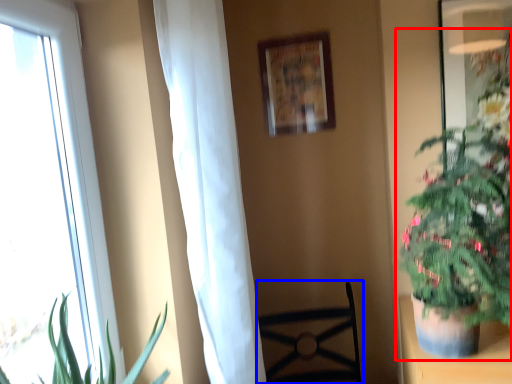
Question: Which object appears farthest to the camera in this image, houseplant (highlighted by a red box) or furniture (highlighted by a blue box)?

Choices:
 (A) houseplant
 (B) furniture

Answer: (B)